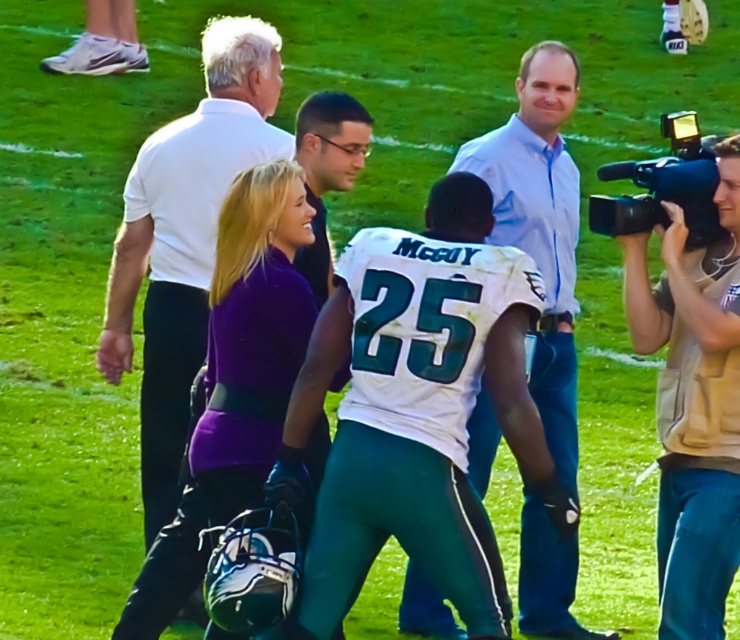
Does white smooth shirt at upper left appear on the right side of light blue shirt at center?

In fact, white smooth shirt at upper left is to the left of light blue shirt at center.

Is point (169, 323) farther from viewer compared to point (551, 340)?

No, (169, 323) is closer to viewer.

Where is `white smooth shirt at upper left`? Image resolution: width=740 pixels, height=640 pixels. white smooth shirt at upper left is located at coordinates (185, 240).

Does white smooth shirt at upper left have a greater height compared to beige fabric camera at right?

Indeed, white smooth shirt at upper left has a greater height compared to beige fabric camera at right.

Who is taller, white smooth shirt at upper left or beige fabric camera at right?

white smooth shirt at upper left

What do you see at coordinates (185, 240) in the screenshot? I see `white smooth shirt at upper left` at bounding box center [185, 240].

What are the coordinates of `white smooth shirt at upper left` in the screenshot? It's located at (185, 240).

Who is positioned more to the right, light blue shirt at center or black plastic video camera at right?

From the viewer's perspective, black plastic video camera at right appears more on the right side.

Which is behind, point (521, 140) or point (613, 173)?

Positioned behind is point (521, 140).

Image resolution: width=740 pixels, height=640 pixels. In order to click on light blue shirt at center in this screenshot , I will do `click(539, 227)`.